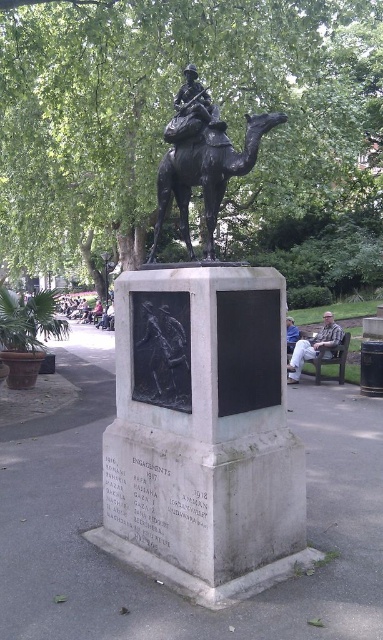
What do you see at coordinates (206, 173) in the screenshot? I see `bronze statue of camel at center` at bounding box center [206, 173].

Does bronze statue of camel at center have a larger size compared to black matte relief at center?

Yes, bronze statue of camel at center is bigger than black matte relief at center.

Is point (163, 160) farther from viewer compared to point (145, 332)?

Yes, point (163, 160) is farther from viewer.

Image resolution: width=383 pixels, height=640 pixels. I want to click on bronze statue of camel at center, so click(206, 173).

In the scene shown: Who is shorter, bronze statue at center or metallic helmet at center?

metallic helmet at center

Find the location of a particular element. This screenshot has height=640, width=383. bronze statue at center is located at coordinates [202, 433].

Is camouflage-patterned shirt at lower right taller than metallic helmet at center?

No.

Which is more to the right, camouflage-patterned shirt at lower right or metallic helmet at center?

camouflage-patterned shirt at lower right

Identify the location of camouflage-patterned shirt at lower right. (314, 346).